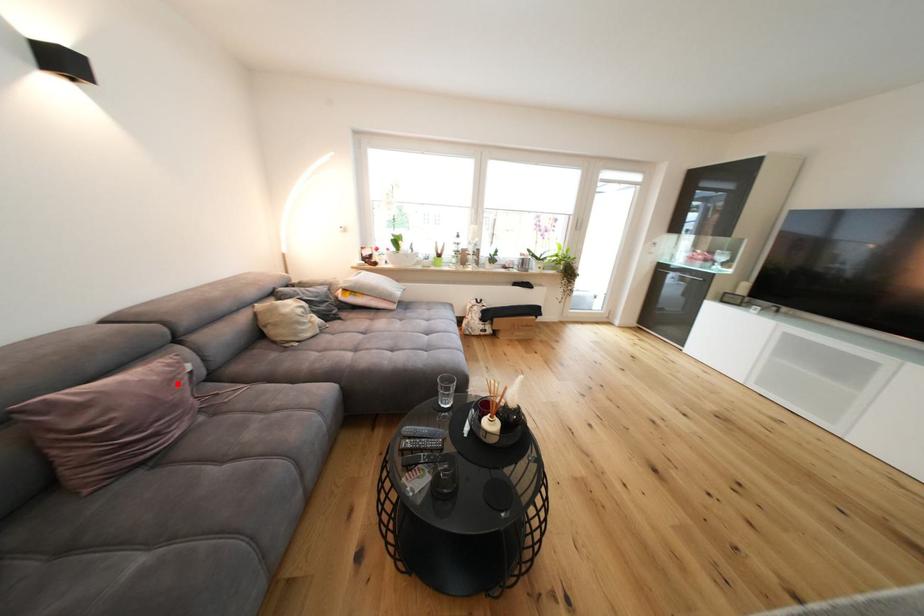
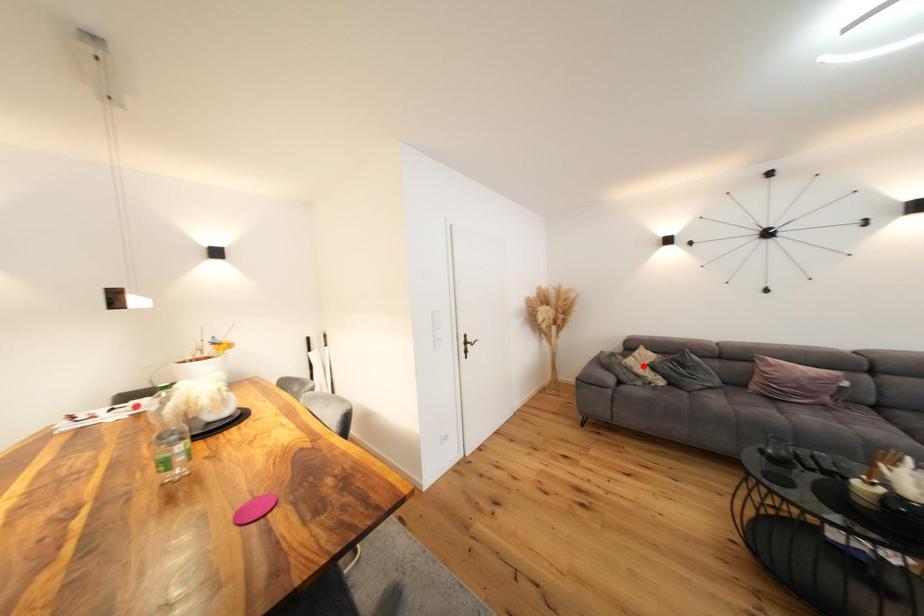
I am providing you with two images of the same scene from different viewpoints. A red point is marked on the first image and another point is marked on the second image. Are the points marked in image1 and image2 representing the same 3D position?

No